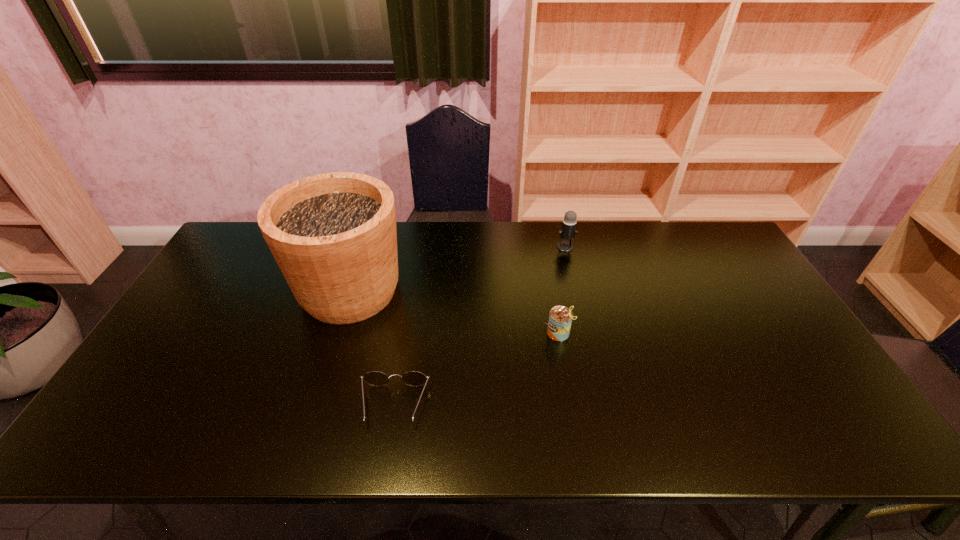
Find the location of a particular element. the tallest object is located at coordinates (333, 235).

This screenshot has width=960, height=540. In order to click on the farthest object in this screenshot , I will do `click(568, 231)`.

The width and height of the screenshot is (960, 540). Find the location of `the rightmost object`. the rightmost object is located at coordinates (568, 231).

You are a GUI agent. You are given a task and a screenshot of the screen. Output one action in this format:
    pyautogui.click(x=<x>, y=<y>)
    Task: Click on the can
    
    Given the screenshot: What is the action you would take?
    tap(560, 317)

I want to click on the second shortest object, so click(x=560, y=317).

The width and height of the screenshot is (960, 540). I want to click on the nearest object, so click(x=375, y=378).

At what (x,y) coordinates should I click in order to perform the action: click on spectacles. Please return your answer as a coordinate pair (x, y). The image size is (960, 540). Looking at the image, I should click on (375, 378).

Find the location of a particular element. This screenshot has height=540, width=960. vacant space located on the right of the flowerpot is located at coordinates (452, 291).

Where is `free space located on the front of the second tallest object`? free space located on the front of the second tallest object is located at coordinates (571, 272).

Where is `free space located on the left of the can`? This screenshot has width=960, height=540. free space located on the left of the can is located at coordinates (484, 333).